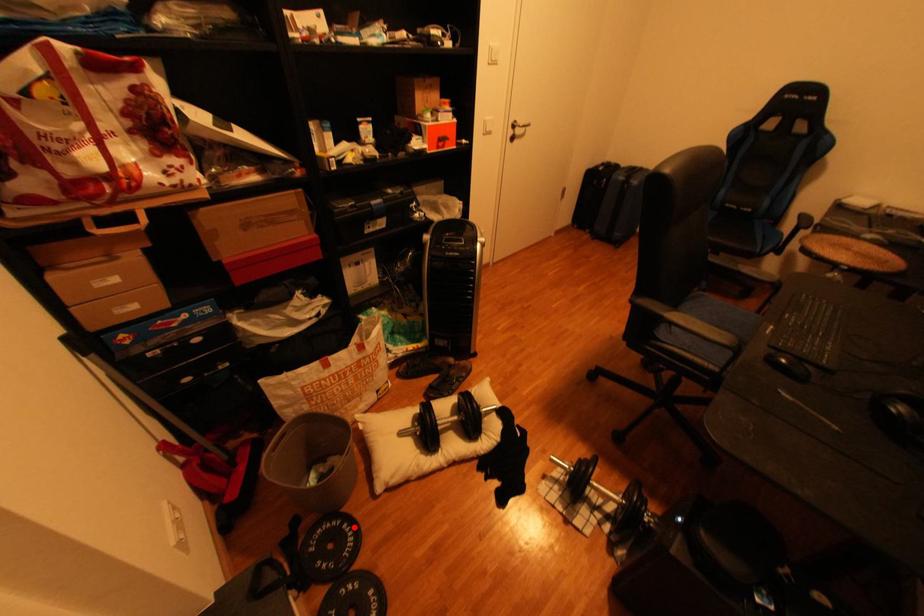
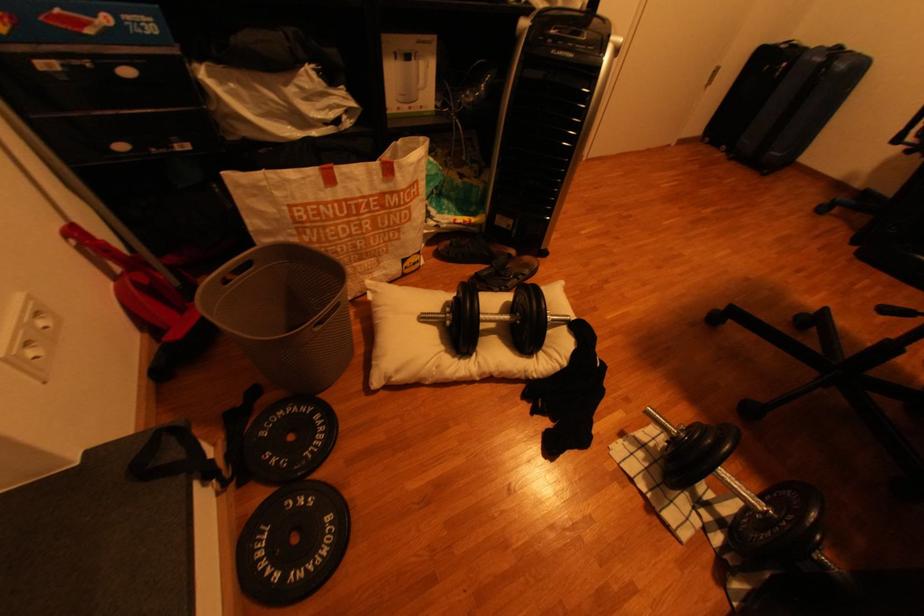
Find the pixel in the second image that matches the highlighted location in the first image.

(325, 419)